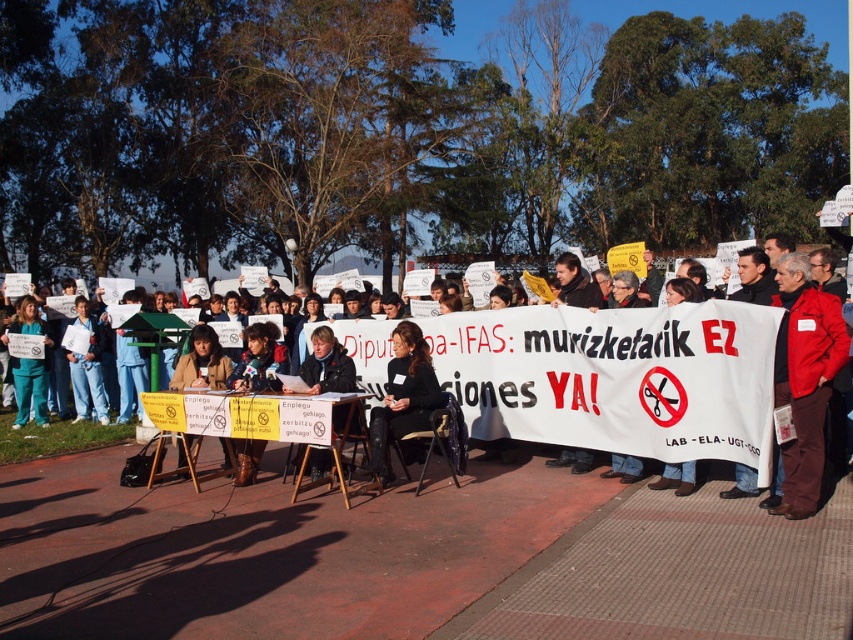
You are a photographer standing in front of the demonstration area. You need to capture a photo that includes both the red matte jacket at right and the brown leather jacket at center. Which jacket should you position closer to the right edge of your camera frame to ensure both are visible?

The red matte jacket at right is positioned on the right side of brown leather jacket at center. To include both in the photo, you should position the red matte jacket at right closer to the right edge of the camera frame since it is already on the right side of the brown leather jacket at center.

Based on the photo, you are a photographer standing at the demonstration. You need to capture a photo that includes both the red matte jacket at right and the brown leather jacket at center. The camera you have can only focus on objects within a 5 meter range. Will you be able to get both jackets in focus?

The distance between the red matte jacket at right and the brown leather jacket at center is 5.52 meters, which exceeds the camera focus range of 5 meters. Therefore, you cannot get both jackets in focus at the same time.